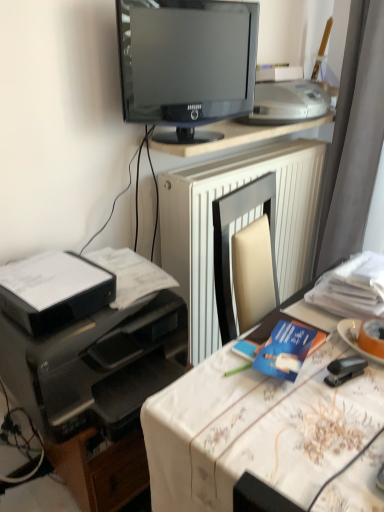
Question: From a real-world perspective, is black plastic printer at left, the 1th printer in the bottom-to-top sequence, below black plastic printer at lower left, which is the 2th printer from top to bottom?

Choices:
 (A) no
 (B) yes

Answer: (B)

Question: Is black plastic printer at left, arranged as the third printer when viewed from the top, wider than black plastic printer at lower left, acting as the 2th printer starting from the bottom?

Choices:
 (A) yes
 (B) no

Answer: (A)

Question: Is black plastic printer at left, the 1th printer in the bottom-to-top sequence, positioned with its back to black plastic printer at lower left, which is the 2th printer from top to bottom?

Choices:
 (A) no
 (B) yes

Answer: (A)

Question: Can black plastic printer at lower left, acting as the 2th printer starting from the bottom, be found inside black plastic printer at left, the 1th printer in the bottom-to-top sequence?

Choices:
 (A) yes
 (B) no

Answer: (B)

Question: Does black plastic printer at left, the 1th printer in the bottom-to-top sequence, touch black plastic printer at lower left, which is the 2th printer from top to bottom?

Choices:
 (A) yes
 (B) no

Answer: (B)

Question: Considering the positions of white plastic printer at upper right, the 3th printer ordered from the bottom, and blue paper at center in the image, is white plastic printer at upper right, the 3th printer ordered from the bottom, taller or shorter than blue paper at center?

Choices:
 (A) short
 (B) tall

Answer: (B)

Question: Considering their positions, is white plastic printer at upper right, the 1th printer positioned from the top, located in front of or behind blue paper at center?

Choices:
 (A) behind
 (B) front

Answer: (A)

Question: Visually, is white plastic printer at upper right, the 3th printer ordered from the bottom, positioned to the left or to the right of blue paper at center?

Choices:
 (A) left
 (B) right

Answer: (B)

Question: From the image's perspective, relative to blue paper at center, is white plastic printer at upper right, the 1th printer positioned from the top, above or below?

Choices:
 (A) above
 (B) below

Answer: (A)

Question: Is black plastic printer at lower left, acting as the 2th printer starting from the bottom, bigger or smaller than black glossy monitor at upper center?

Choices:
 (A) big
 (B) small

Answer: (B)

Question: Is black plastic printer at lower left, which is the 2th printer from top to bottom, inside the boundaries of black glossy monitor at upper center, or outside?

Choices:
 (A) inside
 (B) outside

Answer: (B)

Question: Considering their positions, is black plastic printer at lower left, which is the 2th printer from top to bottom, located in front of or behind black glossy monitor at upper center?

Choices:
 (A) behind
 (B) front

Answer: (B)

Question: Would you say black plastic printer at lower left, acting as the 2th printer starting from the bottom, is to the left or to the right of black glossy monitor at upper center in the picture?

Choices:
 (A) left
 (B) right

Answer: (A)

Question: Looking at the image, does white textured radiator at center seem bigger or smaller compared to orange matte plate at right?

Choices:
 (A) small
 (B) big

Answer: (B)

Question: Considering the positions of point (188, 266) and point (354, 336), is point (188, 266) closer or farther from the camera than point (354, 336)?

Choices:
 (A) farther
 (B) closer

Answer: (A)